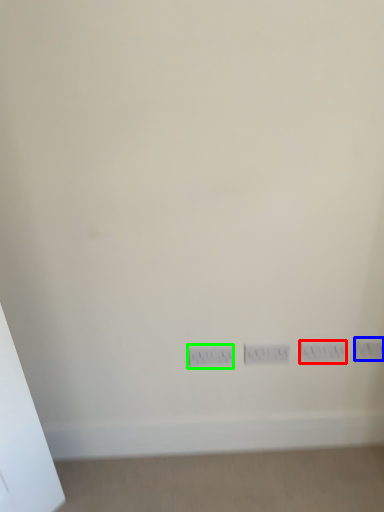
Question: Based on their relative distances, which object is nearer to electric outlet (highlighted by a red box)? Choose from electric outlet (highlighted by a blue box) and power plugs and sockets (highlighted by a green box).

Choices:
 (A) electric outlet
 (B) power plugs and sockets

Answer: (A)